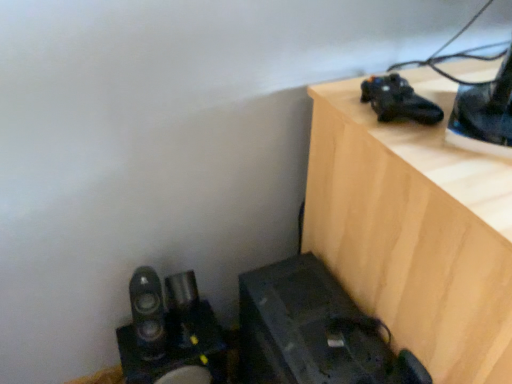
Identify the location of free point above satin black speakers at lower left (from a real-world perspective). (179, 341).